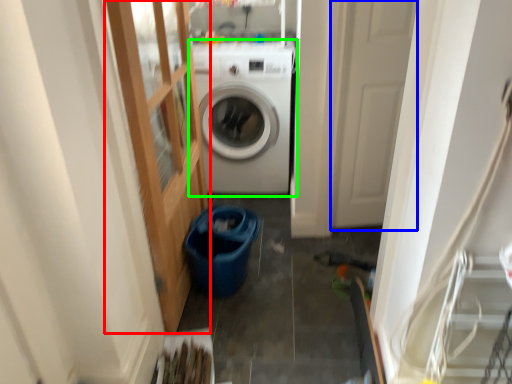
Question: Considering the real-world distances, which object is closest to glass door (highlighted by a red box)? screen door (highlighted by a blue box) or washing machine (highlighted by a green box).

Choices:
 (A) screen door
 (B) washing machine

Answer: (B)